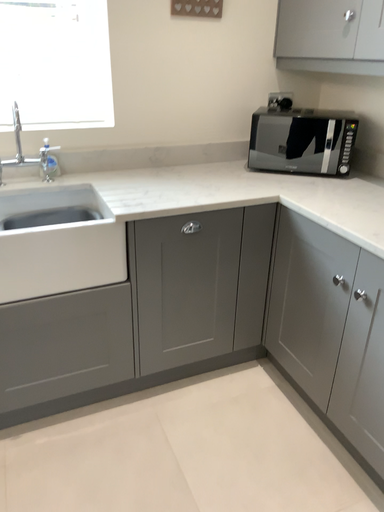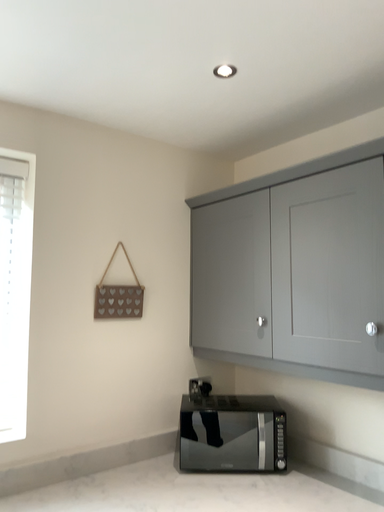
Question: How did the camera likely rotate when shooting the video?

Choices:
 (A) rotated right
 (B) rotated left

Answer: (A)